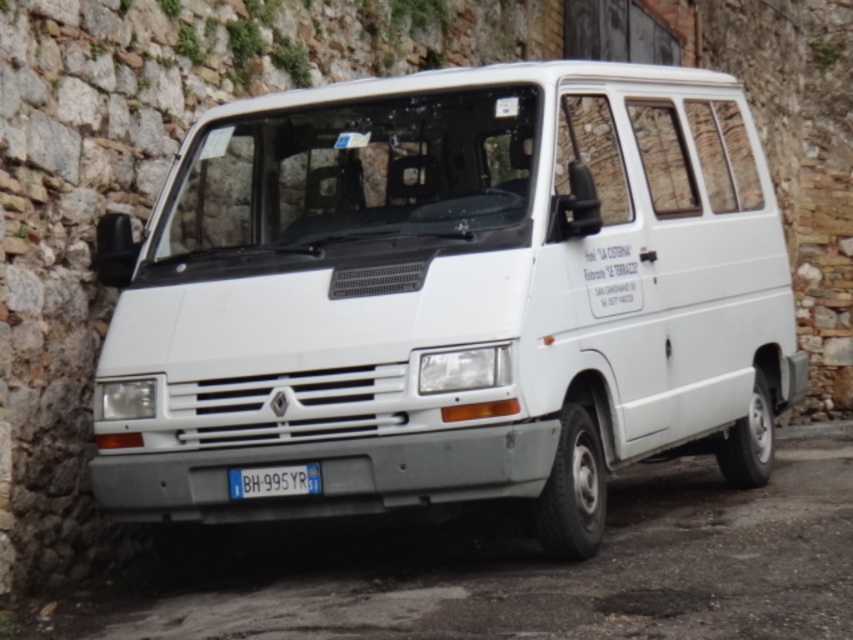
Question: Considering the relative positions of white matte van at center and blue metallic license plate at center in the image provided, where is white matte van at center located with respect to blue metallic license plate at center?

Choices:
 (A) above
 (B) below

Answer: (A)

Question: Among these objects, which one is farthest from the camera?

Choices:
 (A) white matte van at center
 (B) blue metallic license plate at center

Answer: (B)

Question: Is white matte van at center wider than blue metallic license plate at center?

Choices:
 (A) no
 (B) yes

Answer: (B)

Question: Where is white matte van at center located in relation to blue metallic license plate at center in the image?

Choices:
 (A) right
 (B) left

Answer: (A)

Question: Which object is closer to the camera taking this photo?

Choices:
 (A) white matte van at center
 (B) blue metallic license plate at center

Answer: (A)